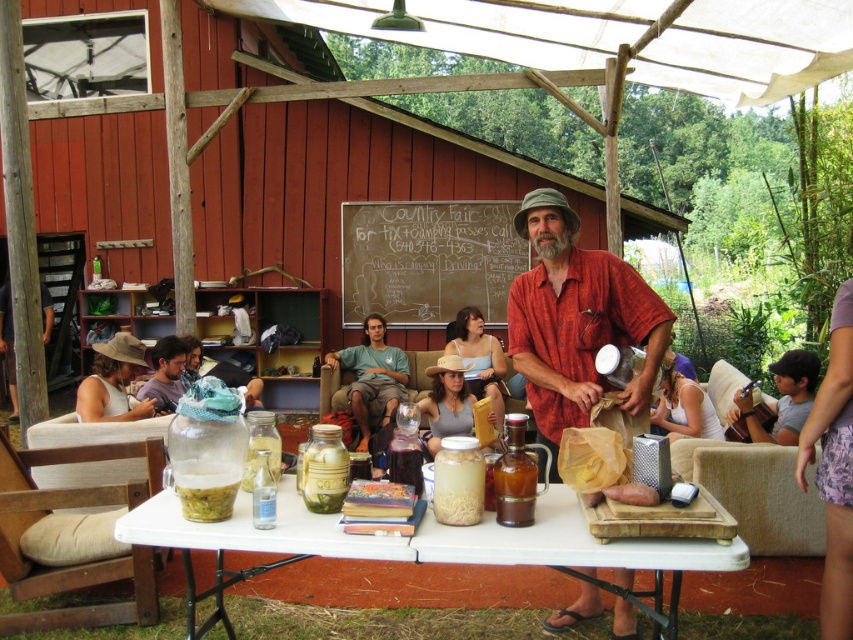
Question: Is matte red shirt at center further to the viewer compared to matte blue shirt at center?

Choices:
 (A) yes
 (B) no

Answer: (B)

Question: Is greenish-yellow paste at center to the right of clear glass bottle at center from the viewer's perspective?

Choices:
 (A) yes
 (B) no

Answer: (B)

Question: Which of the following is the closest to the observer?

Choices:
 (A) (579, 372)
 (B) (445, 422)

Answer: (A)

Question: Based on their relative distances, which object is nearer to the clear glass bottle at center?

Choices:
 (A) matte blue shirt at center
 (B) white plastic table at center
 (C) wooden chair at left
 (D) wooden guitar at lower right

Answer: (B)

Question: In this image, where is white plastic table at center located relative to matte gray tank top at center?

Choices:
 (A) left
 (B) right

Answer: (A)

Question: Which object is the farthest from the white fabric shirt at upper center?

Choices:
 (A) matte red shirt at center
 (B) wooden chair at left

Answer: (B)